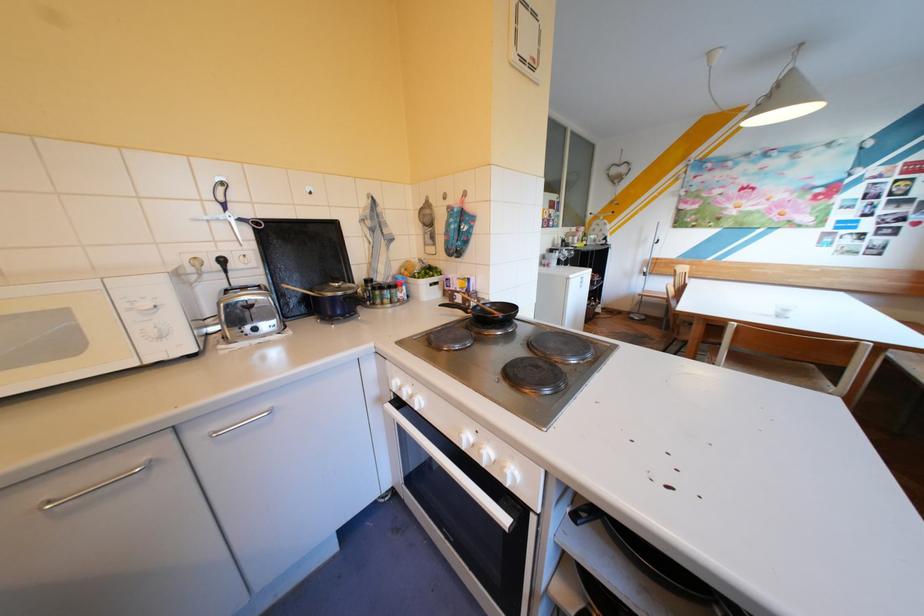
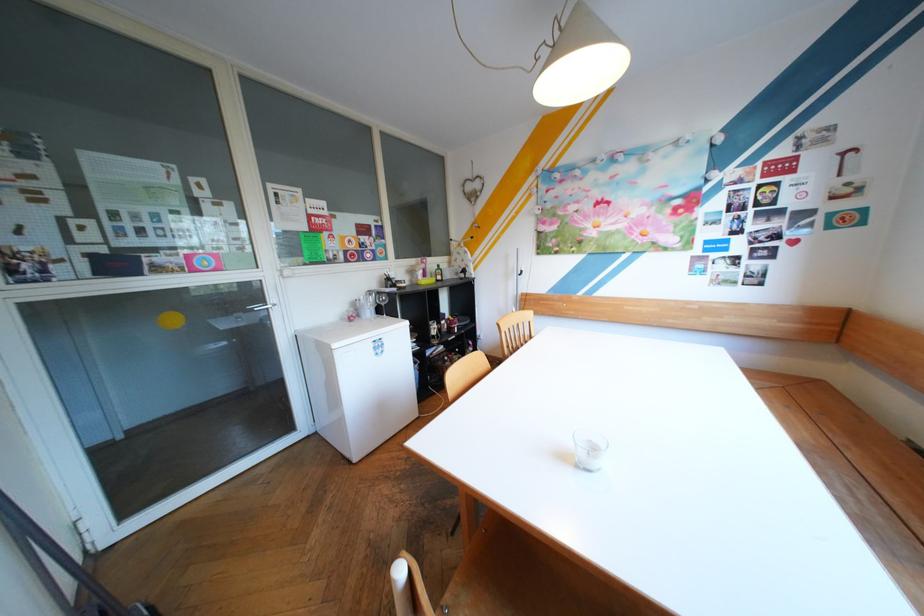
The point at (560, 267) is marked in the first image. Where is the corresponding point in the second image?

(360, 322)